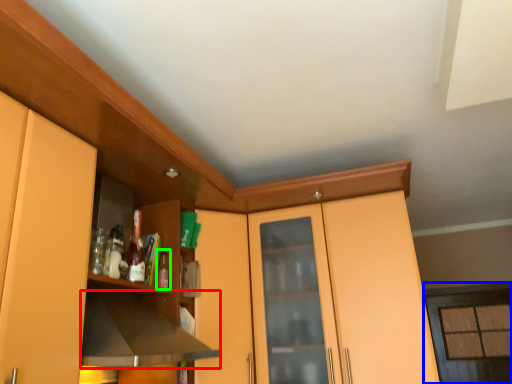
Question: Which is nearer to the exhaust hood (highlighted by a red box)? window (highlighted by a blue box) or bottle (highlighted by a green box).

Choices:
 (A) window
 (B) bottle

Answer: (B)